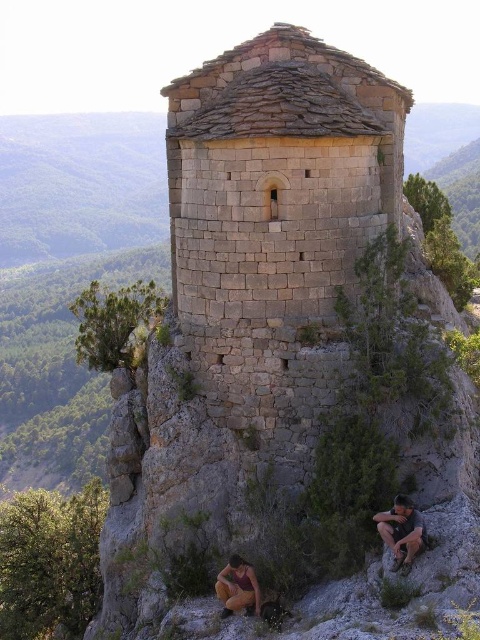
Can you confirm if matte gray rock at lower right is positioned above orange fabric pants at lower center?

Indeed, matte gray rock at lower right is positioned over orange fabric pants at lower center.

Is matte gray rock at lower right further to camera compared to orange fabric pants at lower center?

No, matte gray rock at lower right is closer to the viewer.

You are a GUI agent. You are given a task and a screenshot of the screen. Output one action in this format:
    pyautogui.click(x=<x>, y=<y>)
    Task: Click on the matte gray rock at lower right
    
    Given the screenshot: What is the action you would take?
    pyautogui.click(x=402, y=531)

Identify the location of matte gray rock at lower right. This screenshot has width=480, height=640. (402, 531).